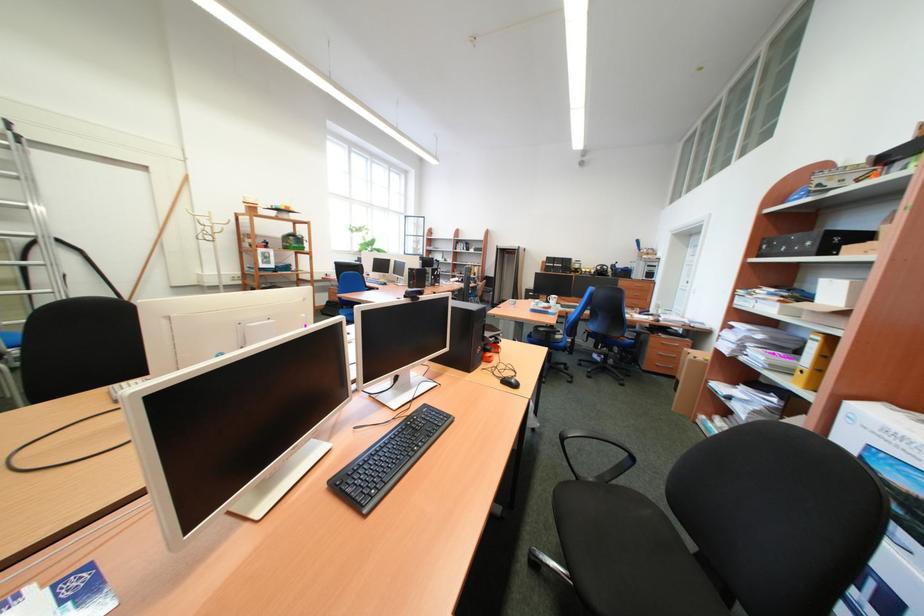
Identify the location of blue chair armrest. The height and width of the screenshot is (616, 924). (545, 333).